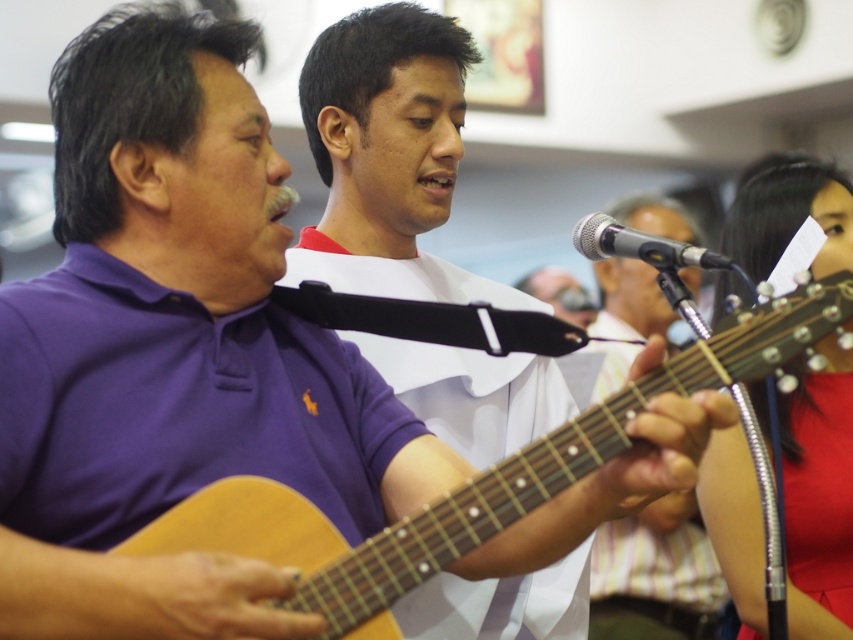
You are a photographer setting up a shot for a music performance. You want to focus on the wooden acoustic guitar at center and the silver metallic microphone at center. Which object should you adjust your camera focus on first if you need to prioritize the one closer to you?

The wooden acoustic guitar at center is closer to you than the silver metallic microphone at center, so you should adjust your camera focus on the wooden acoustic guitar at center first.

You are standing in the room and want to locate the matte purple polo shirt at center. According to the coordinates provided, where should you look?

You should look at point [387,156] to find the matte purple polo shirt at center.

You are a photographer setting up for a live performance. You need to adjust the lighting so that the wooden acoustic guitar at center and the silver metallic microphone at center are both well illuminated. Since the microphone is closer to the camera, you want to ensure the guitar also gets enough light. Based on their positions, which object should you focus the light on first to ensure both are properly lit?

The wooden acoustic guitar at center is below the silver metallic microphone at center. Since the microphone is closer to the camera, focusing the light on the microphone first would naturally illuminate the guitar below it as well, ensuring both are properly lit.